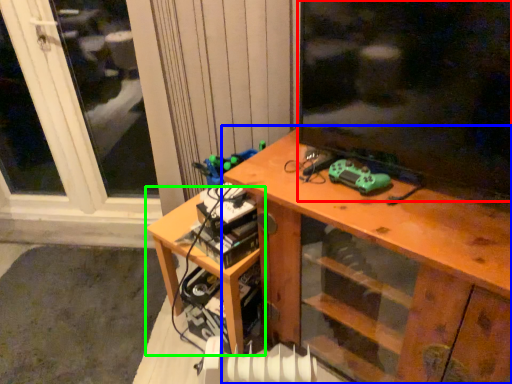
Question: Which object is the closest to the window screen (highlighted by a red box)? Choose among these: desk (highlighted by a blue box) or table (highlighted by a green box).

Choices:
 (A) desk
 (B) table

Answer: (A)